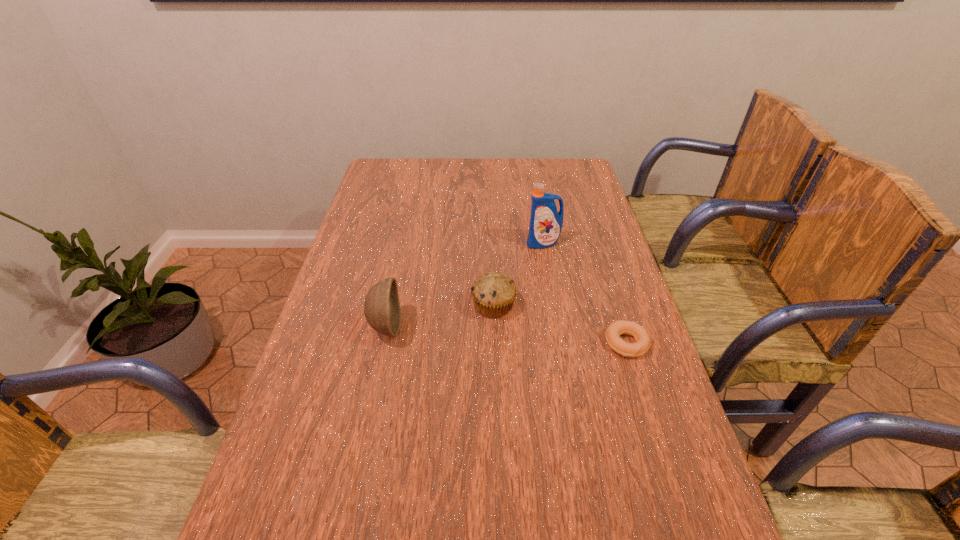
Where is `detergent`? detergent is located at coordinates (546, 222).

At what (x,y) coordinates should I click in order to perform the action: click on the second object from right to left. Please return your answer as a coordinate pair (x, y). The image size is (960, 540). Looking at the image, I should click on (546, 222).

Locate an element on the screen. bowl is located at coordinates (382, 310).

Locate an element on the screen. the third shortest object is located at coordinates (382, 310).

The height and width of the screenshot is (540, 960). I want to click on the second shortest object, so coord(493,293).

Identify the location of the second object from left to right. (493, 293).

Where is `the shortest object`? The width and height of the screenshot is (960, 540). the shortest object is located at coordinates (643, 341).

The image size is (960, 540). Find the location of `bagel`. bagel is located at coordinates point(643,341).

In order to click on free space located on the label of the third object from left to right in this screenshot , I will do `click(552, 292)`.

The height and width of the screenshot is (540, 960). Identify the location of free space located 0.270m on the front of the bowl. (359, 456).